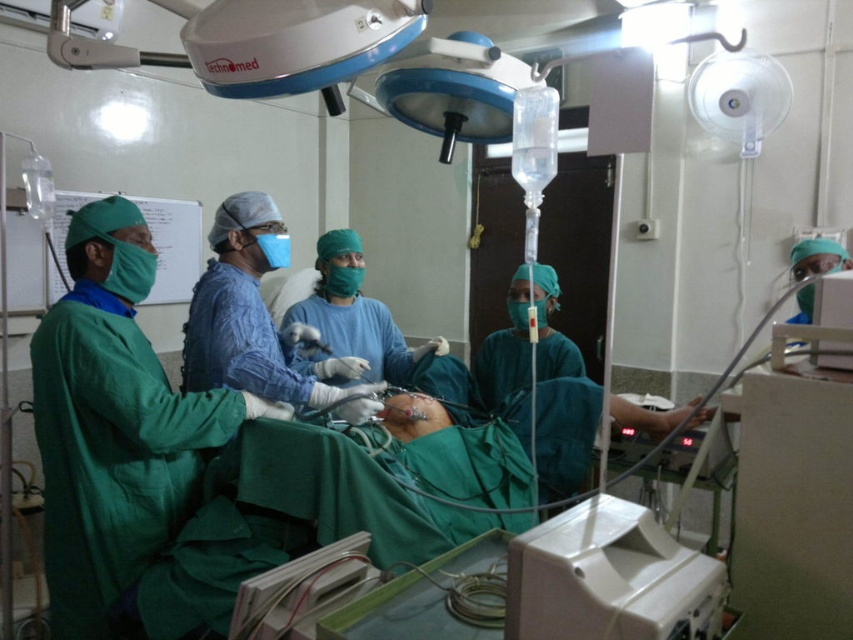
Question: Is green matte surgical gown at center smaller than white plastic cables at center?

Choices:
 (A) no
 (B) yes

Answer: (A)

Question: Does green surgical gown at left have a greater width compared to green matte surgical gown at center?

Choices:
 (A) yes
 (B) no

Answer: (B)

Question: Which point is closer to the camera?

Choices:
 (A) green surgical gown at left
 (B) white plastic monitor at lower center

Answer: (B)

Question: Which object is positioned closest to the green matte surgical gown at center?

Choices:
 (A) white plastic monitor at lower center
 (B) white plastic cables at center

Answer: (B)

Question: Which of the following is the closest to the observer?

Choices:
 (A) (270, 637)
 (B) (106, 624)
 (C) (701, 608)

Answer: (C)

Question: Is green surgical gown at left positioned at the back of white plastic cables at center?

Choices:
 (A) yes
 (B) no

Answer: (A)